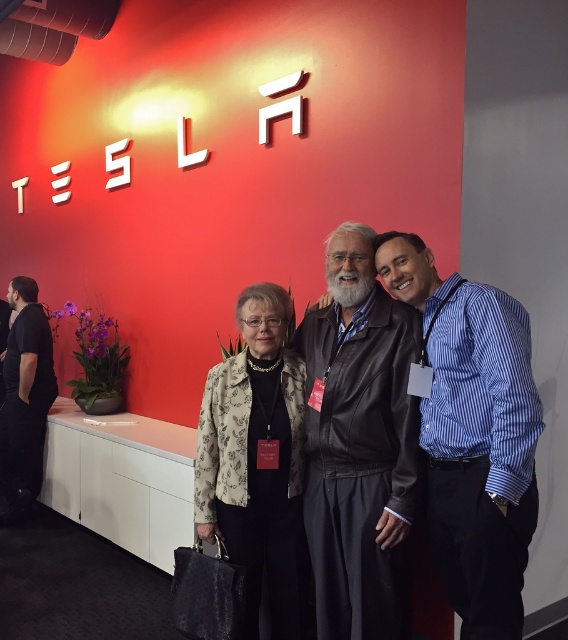
You are trying to decide which jacket to choose for a casual evening out. Both the leather jacket at center and the black leather jacket at left are options. Based on their sizes, which one would be more comfortable for layering over a sweater?

The black leather jacket at left is wider than the leather jacket at center, so it would be more comfortable for layering over a sweater.